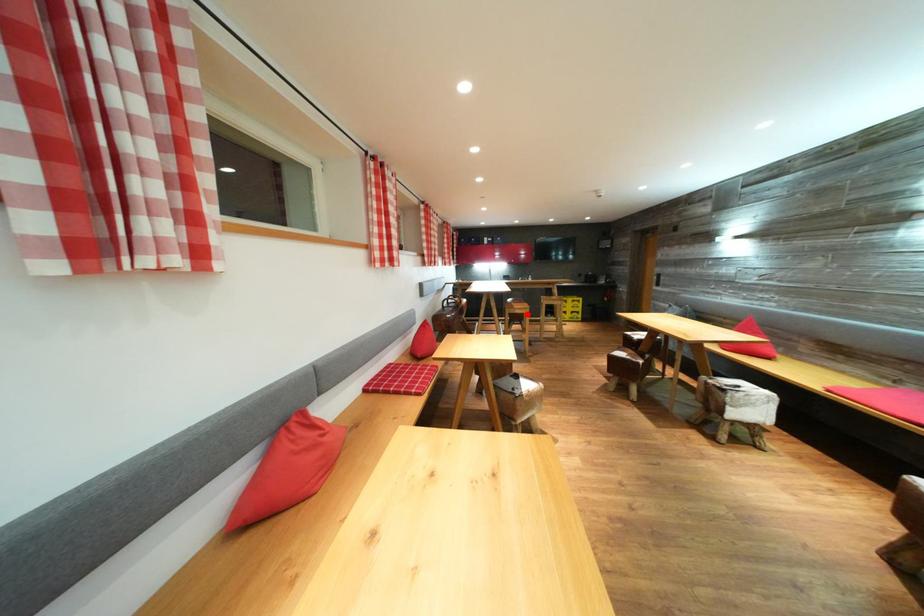
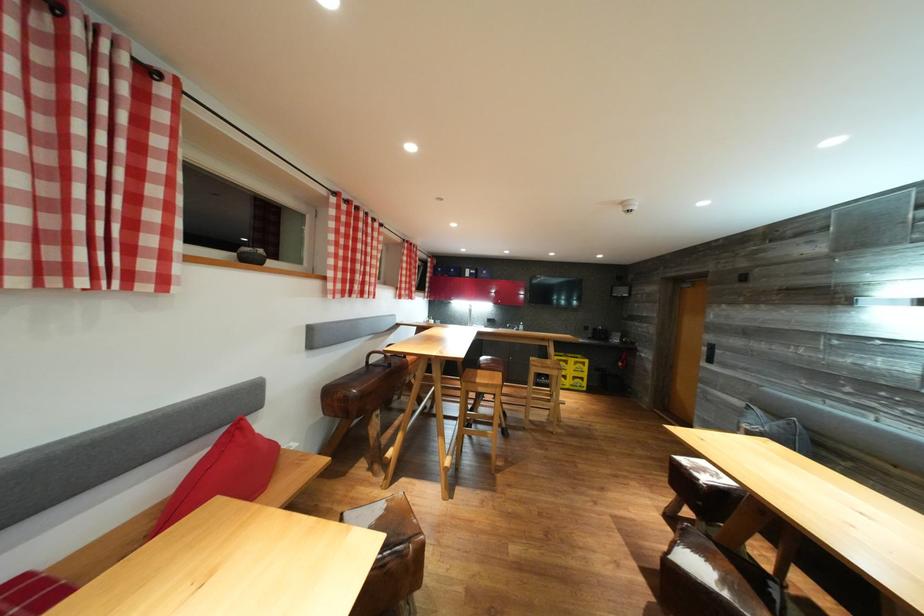
Question: I am providing you with two images of the same scene from different viewpoints. A red point is marked on the first image. Is the red point's position out of view in image 2?

Choices:
 (A) Yes
 (B) No

Answer: (B)